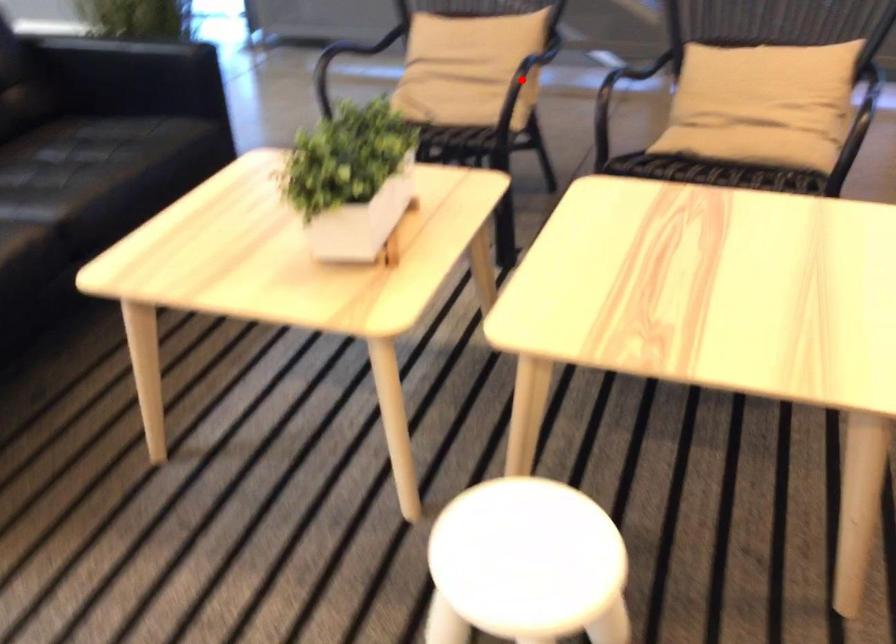
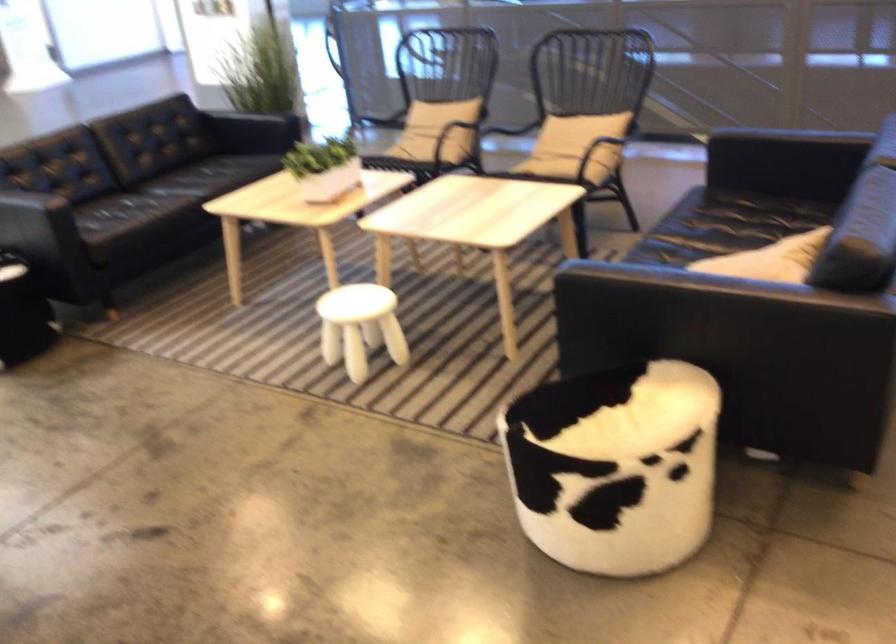
Question: I am providing you with two images of the same scene from different viewpoints. Image1 has a red point marked. In image2, the corresponding 3D location appears at what relative position? Reply with the corresponding letter.

Choices:
 (A) Closer
 (B) Farther

Answer: (B)